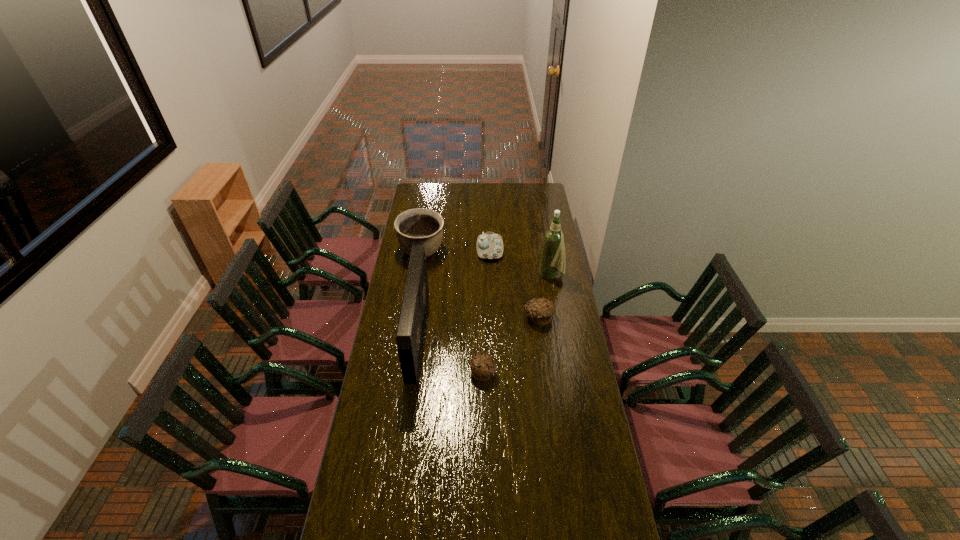
You are a GUI agent. You are given a task and a screenshot of the screen. Output one action in this format:
    pyautogui.click(x=<x>, y=<y>)
    Task: Click on the nearer muffin
    The height and width of the screenshot is (540, 960).
    Given the screenshot: What is the action you would take?
    [482, 366]

This screenshot has width=960, height=540. I want to click on the left muffin, so click(x=482, y=366).

What are the coordinates of `the taller muffin` in the screenshot? It's located at (540, 310).

Where is `the right muffin`? The width and height of the screenshot is (960, 540). the right muffin is located at coordinates (540, 310).

Where is `chinaware`? chinaware is located at coordinates (489, 245).

Locate an element on the screen. Image resolution: width=960 pixels, height=540 pixels. the fourth shortest object is located at coordinates (415, 227).

Where is `the fourth nearest object`? The image size is (960, 540). the fourth nearest object is located at coordinates (553, 255).

I want to click on wine bottle, so click(x=553, y=255).

Locate an element on the screen. Image resolution: width=960 pixels, height=540 pixels. the fifth shortest object is located at coordinates (409, 336).

You are a GUI agent. You are given a task and a screenshot of the screen. Output one action in this format:
    pyautogui.click(x=<x>, y=<y>)
    Task: Click on the vacant space located on the back of the shortest object
    
    Given the screenshot: What is the action you would take?
    pyautogui.click(x=483, y=335)